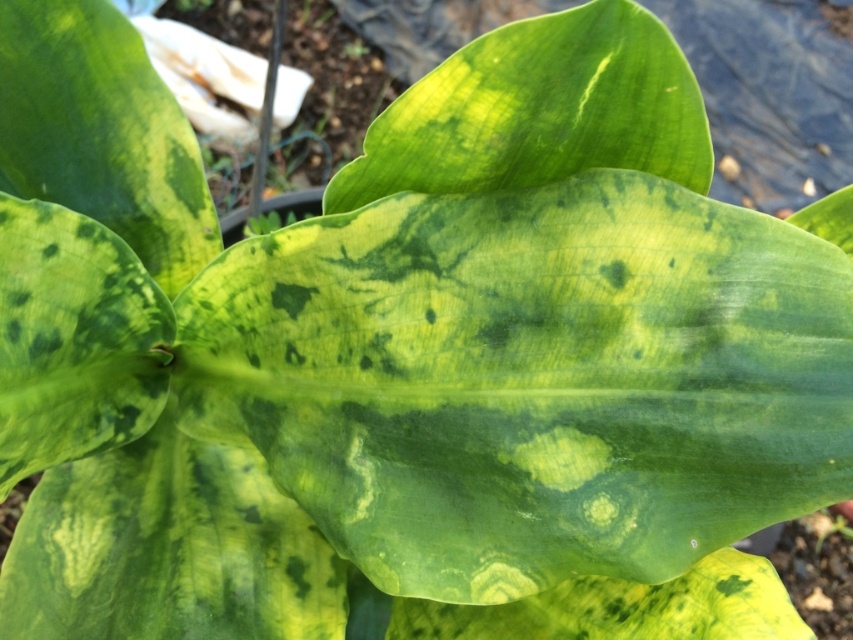
Question: Can you confirm if green spotted leaf at center is smaller than green textured leaf at center?

Choices:
 (A) no
 (B) yes

Answer: (A)

Question: Which of the following is the farthest from the observer?

Choices:
 (A) green spotted leaf at center
 (B) green textured leaf at center

Answer: (A)

Question: Can you confirm if green spotted leaf at center is positioned below green textured leaf at center?

Choices:
 (A) yes
 (B) no

Answer: (A)

Question: Which object appears closest to the camera in this image?

Choices:
 (A) green spotted leaf at center
 (B) green textured leaf at center

Answer: (B)

Question: Can you confirm if green spotted leaf at center is bigger than green textured leaf at center?

Choices:
 (A) yes
 (B) no

Answer: (A)

Question: Among these objects, which one is nearest to the camera?

Choices:
 (A) green spotted leaf at center
 (B) green textured leaf at center

Answer: (B)